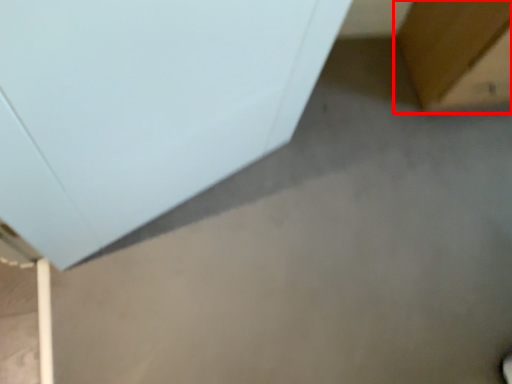
Question: Where is furniture (annotated by the red box) located in relation to furniture in the image?

Choices:
 (A) left
 (B) right

Answer: (B)